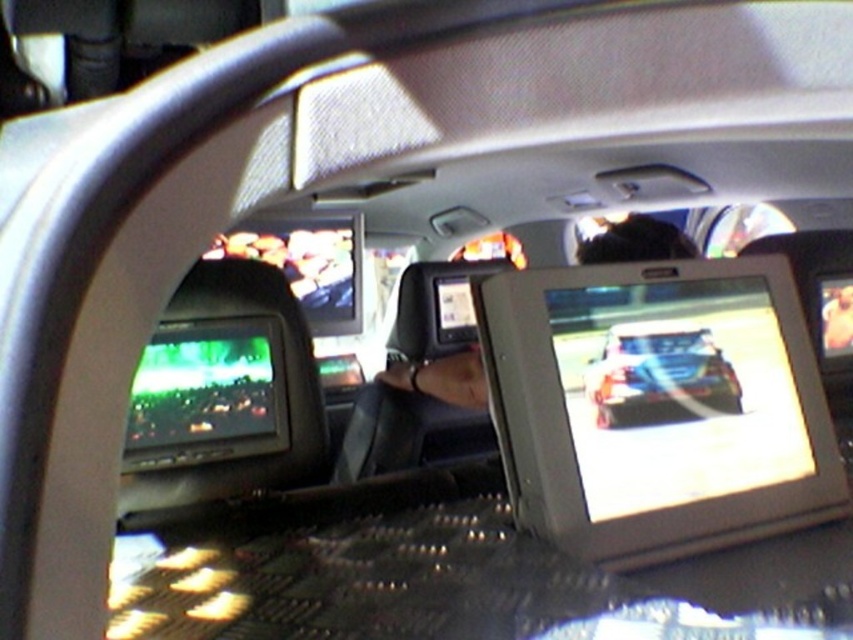
You are a passenger in the vehicle and want to know which object is smaller between the shiny metallic car at center and the matte black monitor at center. Which one is smaller?

The shiny metallic car at center is smaller than the matte black monitor at center.

You are sitting in the back seat of the vehicle and want to reach the point at coordinates point (772,465). If your arm can extend 30 inches, can you reach it?

The point (772,465) is 36.82 inches away from the camera, which is farther than your arm can reach. You cannot reach it.

You are a passenger in the vehicle and want to know the exact position of the shiny metallic car at center. Where is it located in terms of coordinates?

The shiny metallic car at center is located at coordinates point [659,376].